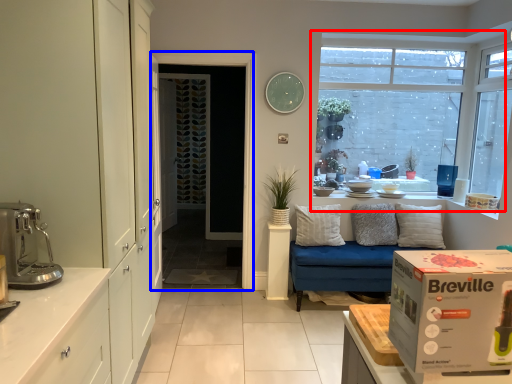
Question: Which of the following is the farthest to the observer, window (highlighted by a red box) or screen door (highlighted by a blue box)?

Choices:
 (A) window
 (B) screen door

Answer: (A)